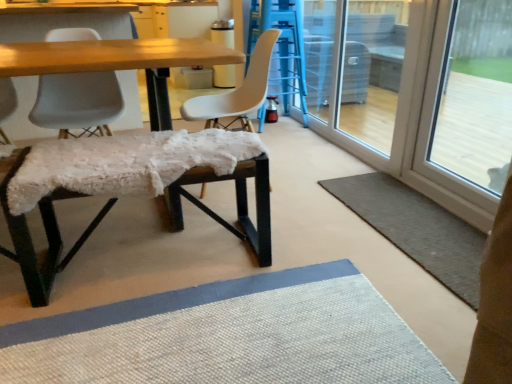
Question: Is wooden table at center touching transparent glass screen door at right?

Choices:
 (A) no
 (B) yes

Answer: (A)

Question: Is the position of wooden table at center more distant than that of transparent glass screen door at right?

Choices:
 (A) yes
 (B) no

Answer: (A)

Question: Does wooden table at center have a smaller size compared to transparent glass screen door at right?

Choices:
 (A) yes
 (B) no

Answer: (B)

Question: From a real-world perspective, is wooden table at center on top of transparent glass screen door at right?

Choices:
 (A) no
 (B) yes

Answer: (A)

Question: From the image's perspective, is wooden table at center below transparent glass screen door at right?

Choices:
 (A) no
 (B) yes

Answer: (A)

Question: In terms of width, does fuzzy fabric bench at center, the second bar stool viewed from the back, look wider or thinner when compared to transparent glass screen door at right?

Choices:
 (A) thin
 (B) wide

Answer: (B)

Question: From the image's perspective, relative to transparent glass screen door at right, is fuzzy fabric bench at center, positioned as the 2th bar stool in top-to-bottom order, above or below?

Choices:
 (A) above
 (B) below

Answer: (B)

Question: Looking at the image, does fuzzy fabric bench at center, which is the first bar stool in bottom-to-top order, seem bigger or smaller compared to transparent glass screen door at right?

Choices:
 (A) small
 (B) big

Answer: (A)

Question: In the image, is fuzzy fabric bench at center, the first bar stool when ordered from left to right, on the left side or the right side of transparent glass screen door at right?

Choices:
 (A) right
 (B) left

Answer: (B)

Question: Is point (x=490, y=54) positioned closer to the camera than point (x=76, y=180)?

Choices:
 (A) farther
 (B) closer

Answer: (A)

Question: Would you say transparent glass door at right is inside or outside fuzzy fabric bench at center, positioned as the 2th bar stool in top-to-bottom order?

Choices:
 (A) outside
 (B) inside

Answer: (A)

Question: From their relative heights in the image, would you say transparent glass door at right is taller or shorter than fuzzy fabric bench at center, the second bar stool viewed from the back?

Choices:
 (A) short
 (B) tall

Answer: (B)

Question: Considering the relative positions of transparent glass door at right and fuzzy fabric bench at center, positioned as the 2th bar stool in top-to-bottom order, in the image provided, is transparent glass door at right to the left or to the right of fuzzy fabric bench at center, positioned as the 2th bar stool in top-to-bottom order,?

Choices:
 (A) left
 (B) right

Answer: (B)

Question: From the image's perspective, is matte blue bar stool at center, which appears as the 2th bar stool when viewed from the left, above or below wooden table at center?

Choices:
 (A) above
 (B) below

Answer: (B)

Question: In terms of size, does matte blue bar stool at center, the second bar stool positioned from the bottom, appear bigger or smaller than wooden table at center?

Choices:
 (A) big
 (B) small

Answer: (B)